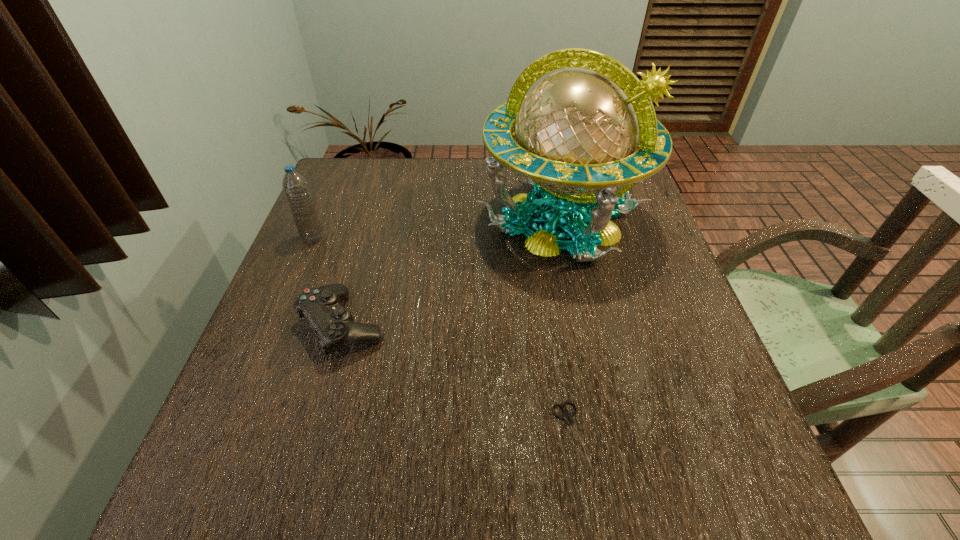
At what (x,y) coordinates should I click in order to perform the action: click on globe. Please return your answer as a coordinate pair (x, y). Image resolution: width=960 pixels, height=540 pixels. Looking at the image, I should click on (574, 136).

The image size is (960, 540). I want to click on the second tallest object, so click(295, 187).

What are the coordinates of `water bottle` in the screenshot? It's located at (295, 187).

Where is `the second object from left to right`? This screenshot has height=540, width=960. the second object from left to right is located at coordinates (334, 325).

You are a GUI agent. You are given a task and a screenshot of the screen. Output one action in this format:
    pyautogui.click(x=<x>, y=<y>)
    Task: Click on the control
    
    Given the screenshot: What is the action you would take?
    pyautogui.click(x=334, y=325)

Where is `shears`? shears is located at coordinates [x=566, y=415].

I want to click on the shortest object, so click(566, 415).

Find the location of a particular element. The height and width of the screenshot is (540, 960). free location located on the front of the tallest object is located at coordinates point(584,323).

Locate an element on the screen. free space located on the back of the water bottle is located at coordinates tap(324, 212).

Where is `vacant position located 0.080m on the back of the third object from right to left`? The height and width of the screenshot is (540, 960). vacant position located 0.080m on the back of the third object from right to left is located at coordinates (360, 267).